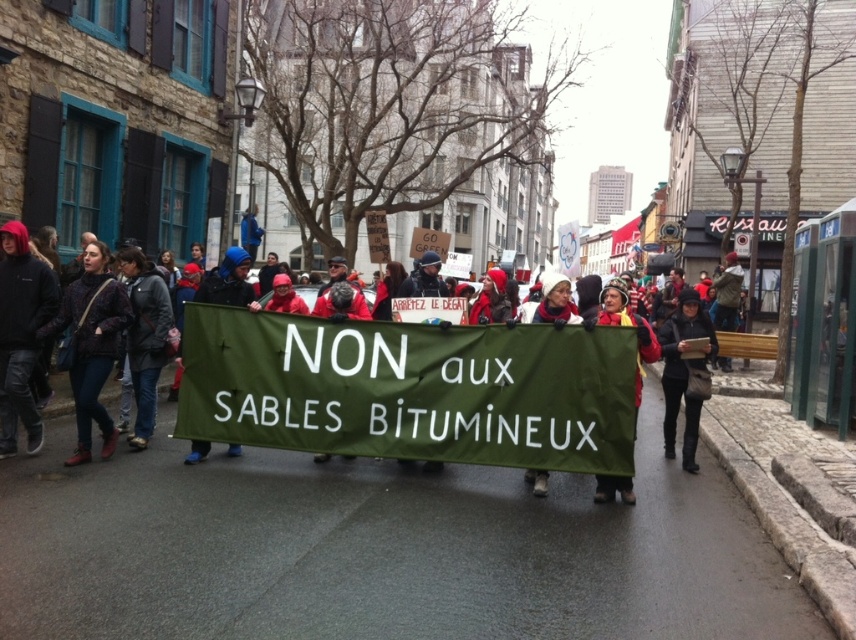
You are a photographer trying to capture a clear shot of the protesters. You notice the black fleece jacket at left and the blue knit hat at center. Which object should you focus on first if you want to ensure both are in the frame without moving the camera?

The black fleece jacket at left is much taller than the blue knit hat at center, so focusing on the taller object first will help ensure both are in the frame.

You are a drone operator trying to capture footage of the protest. You notice two points marked on your screen at coordinates point [10,225] and point [217,292]. According to the scene, which point is closer to the camera?

Point [10,225] is in front of point [217,292], so the point [10,225] is closer to the camera.